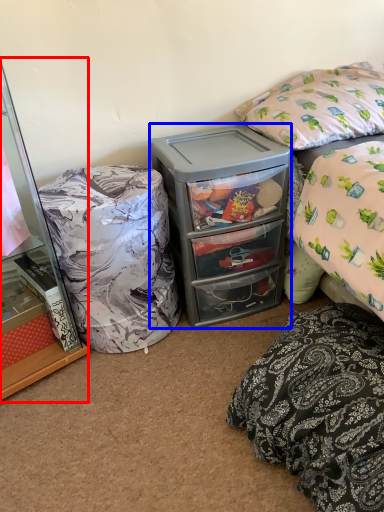
Question: Which object is closer to the camera taking this photo, cabinetry (highlighted by a red box) or cooler (highlighted by a blue box)?

Choices:
 (A) cabinetry
 (B) cooler

Answer: (A)